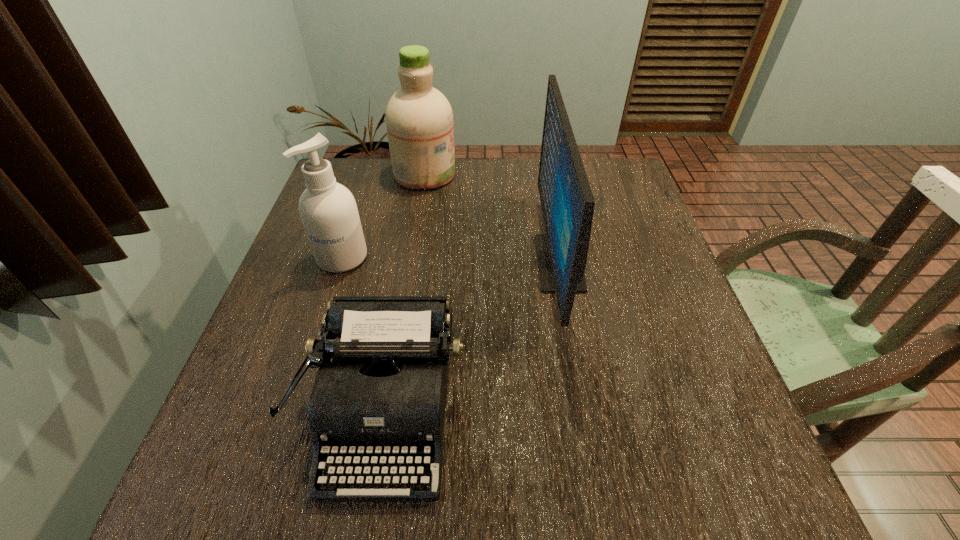
Image resolution: width=960 pixels, height=540 pixels. Find the location of `the farthest object`. the farthest object is located at coordinates (419, 119).

You are a GUI agent. You are given a task and a screenshot of the screen. Output one action in this format:
    pyautogui.click(x=<x>, y=<y>)
    Task: Click on the right cleansing agent
    The height and width of the screenshot is (540, 960).
    Given the screenshot: What is the action you would take?
    pyautogui.click(x=419, y=119)

This screenshot has width=960, height=540. I want to click on computer monitor, so click(567, 202).

Where is `the shorter cleansing agent`? the shorter cleansing agent is located at coordinates (328, 211).

Identify the location of the nearer cleansing agent. This screenshot has height=540, width=960. (328, 211).

This screenshot has height=540, width=960. I want to click on the shortest object, so click(x=384, y=392).

The height and width of the screenshot is (540, 960). I want to click on free point located on the front label of the farthest object, so click(498, 174).

Locate an element on the screen. The width and height of the screenshot is (960, 540). free space located on the screen side of the computer monitor is located at coordinates (492, 262).

This screenshot has width=960, height=540. What are the coordinates of `vacant region located on the screen side of the computer monitor` in the screenshot? It's located at (454, 262).

Where is `vacant space located on the screen side of the computer monitor`? The height and width of the screenshot is (540, 960). vacant space located on the screen side of the computer monitor is located at coordinates (417, 262).